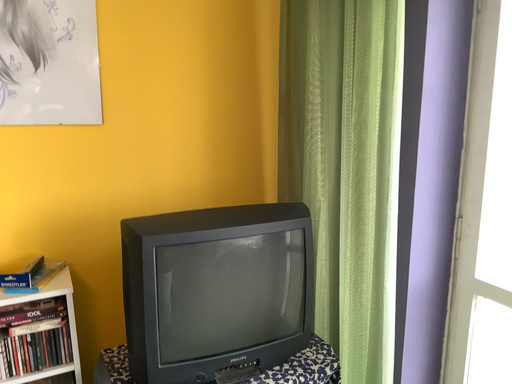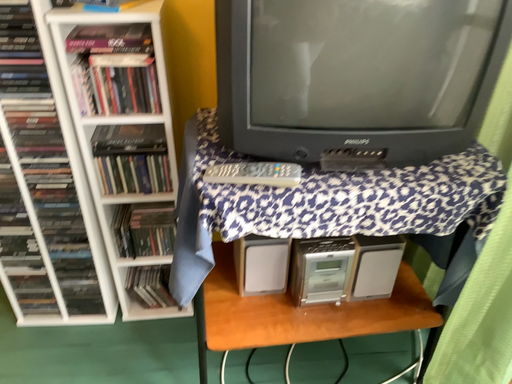
Question: How did the camera likely rotate when shooting the video?

Choices:
 (A) rotated right
 (B) rotated left

Answer: (B)